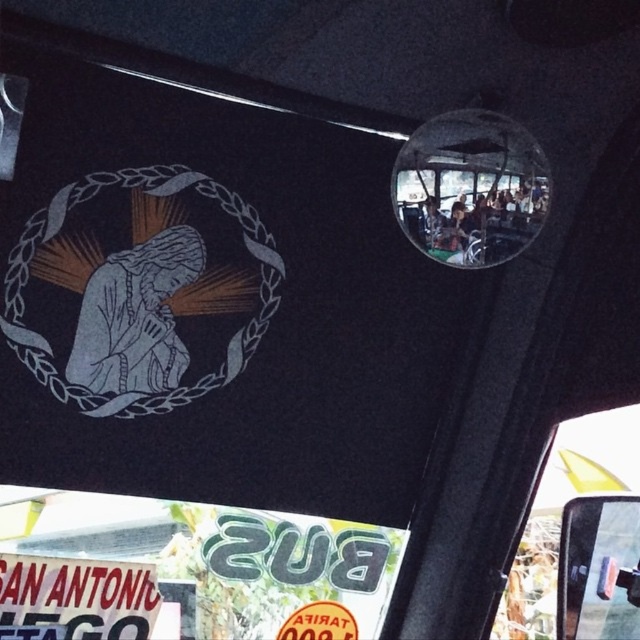
Is transparent glass window at lower right smaller than white matte sign at lower left?

No.

Measure the distance between transparent glass window at lower right and white matte sign at lower left.

transparent glass window at lower right is 91.40 centimeters away from white matte sign at lower left.

Who is more forward, (621,410) or (156,611)?

Positioned in front is point (621,410).

Image resolution: width=640 pixels, height=640 pixels. I want to click on transparent glass window at lower right, so click(561, 513).

You are a GUI agent. You are given a task and a screenshot of the screen. Output one action in this format:
    pyautogui.click(x=<x>, y=<y>)
    Task: Click on the matte silver emblem at center
    The image size is (640, 640).
    Given the screenshot: What is the action you would take?
    pyautogui.click(x=140, y=289)

Is matte silver emblem at center wider than transparent glass window at lower right?

Yes, matte silver emblem at center is wider than transparent glass window at lower right.

Which is in front, point (141, 296) or point (536, 602)?

Point (141, 296) is more forward.

The width and height of the screenshot is (640, 640). I want to click on matte silver emblem at center, so click(x=140, y=289).

Does matte silver emblem at center appear under white matte sign at lower left?

Incorrect, matte silver emblem at center is not positioned below white matte sign at lower left.

Who is positioned more to the left, matte silver emblem at center or white matte sign at lower left?

white matte sign at lower left

Identify the location of matte silver emblem at center. This screenshot has width=640, height=640. (140, 289).